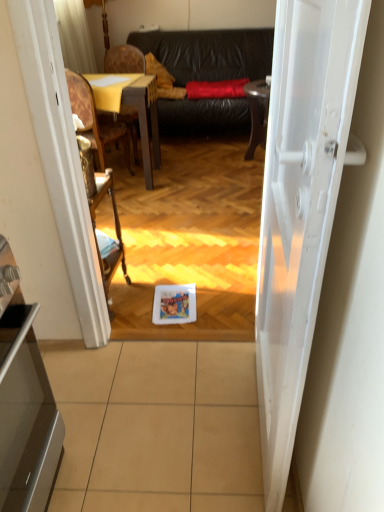
This screenshot has height=512, width=384. I want to click on vacant area situated to the left side of white glossy door at center, so click(x=170, y=422).